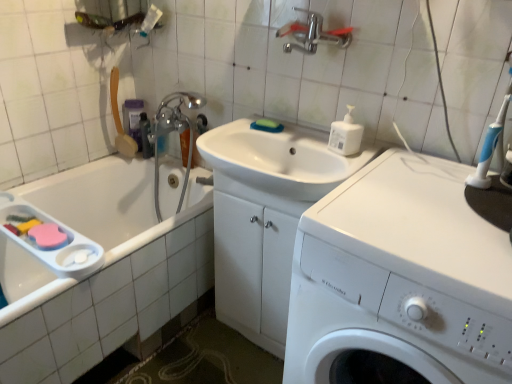
Question: Considering the positions of point (449, 296) and point (256, 124), is point (449, 296) closer or farther from the camera than point (256, 124)?

Choices:
 (A) closer
 (B) farther

Answer: (A)

Question: Would you say white plastic washing machine at center is to the left or to the right of green sponge at sink in the picture?

Choices:
 (A) left
 (B) right

Answer: (B)

Question: Considering the real-world distances, which object is farthest from the translucent plastic bottle at upper left, the 2th toiletry positioned from the left?

Choices:
 (A) white glossy sink at center
 (B) translucent plastic shampoo bottle at upper left, the first toiletry positioned from the left
 (C) white plastic bottle at upper right
 (D) green sponge at sink
 (E) blue plastic toothbrush at upper right

Answer: (E)

Question: Which is farther from the white plastic washing machine at center?

Choices:
 (A) blue plastic toothbrush at upper right
 (B) green sponge at sink
 (C) translucent plastic shampoo bottle at upper left, the second toiletry when ordered from right to left
 (D) translucent plastic bottle at upper left, the 2th toiletry positioned from the left
 (E) white plastic bottle at upper right

Answer: (C)